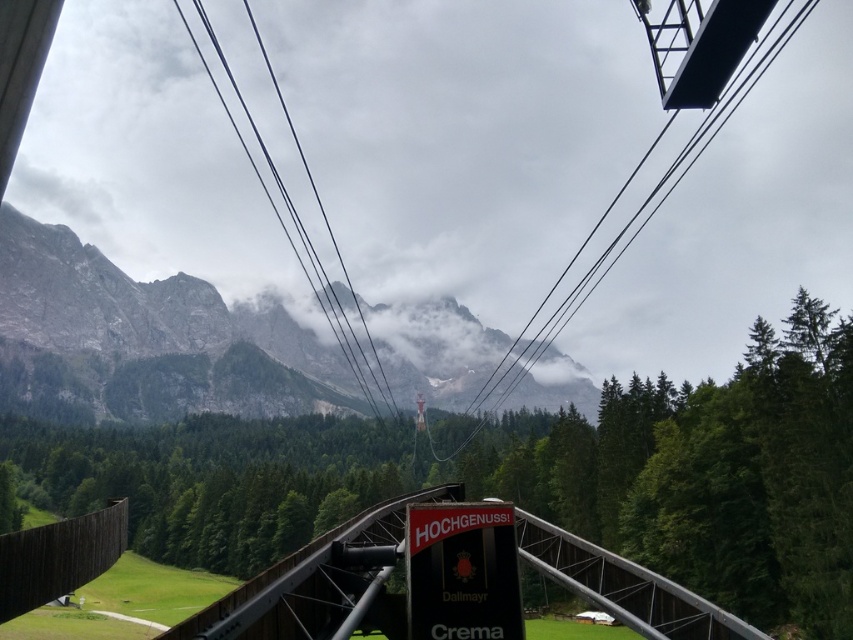
Who is higher up, rocky gray mountain at upper left or metallic wire at upper center?

metallic wire at upper center

Is point (460, 365) positioned behind point (728, 109)?

No, (460, 365) is in front of (728, 109).

Is point (10, 237) closer to viewer compared to point (419, 416)?

Yes, point (10, 237) is closer to viewer.

Locate an element on the screen. The height and width of the screenshot is (640, 853). rocky gray mountain at upper left is located at coordinates (144, 326).

Which is in front, point (729, 108) or point (351, 285)?

Point (351, 285)

Where is `metallic wire at upper center`? metallic wire at upper center is located at coordinates (624, 225).

Who is more forward, (560, 547) or (283, 204)?

Point (560, 547) is more forward.

Does metallic bridge at center have a greater width compared to black wire at center?

Incorrect, metallic bridge at center's width does not surpass black wire at center's.

Does point (688, 625) come closer to viewer compared to point (202, 10)?

Yes, point (688, 625) is in front of point (202, 10).

Where is `metallic bridge at center`? This screenshot has width=853, height=640. metallic bridge at center is located at coordinates (321, 582).